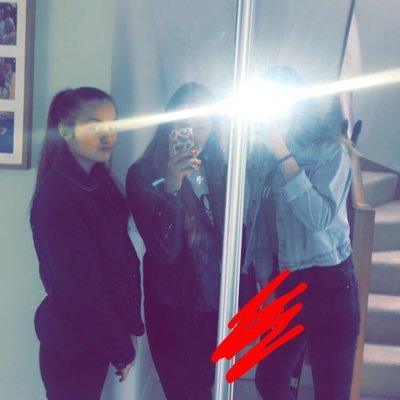
You are a GUI agent. You are given a task and a screenshot of the screen. Output one action in this format:
    pyautogui.click(x=<x>, y=<y>)
    Task: Click on the collage frame bottom
    
    Given the screenshot: What is the action you would take?
    pyautogui.click(x=14, y=168)